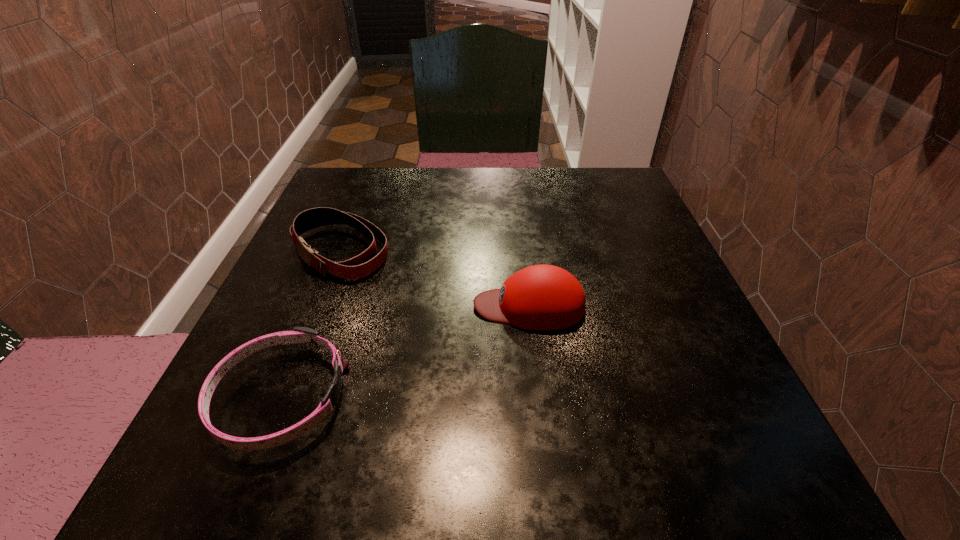
Locate an element on the screen. This screenshot has width=960, height=540. the closest object to the farthest object is located at coordinates (299, 334).

Find the location of a particular element. the closest object to the nearer dog collar is located at coordinates (362, 265).

The height and width of the screenshot is (540, 960). In order to click on vacant area that satisfies the following two spatial constraints: 1. on the front side of the farther dog collar; 2. with the buckle on the nearer dog collar in this screenshot , I will do `click(283, 397)`.